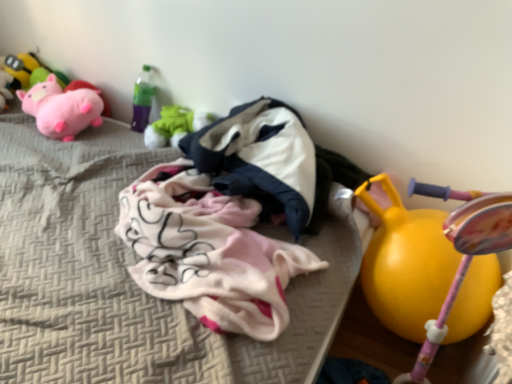
Question: Is rubber yellow ball at right, placed as the 1th toy when sorted from right to left, to the left of soft pink plush at upper left, positioned as the second toy in left-to-right order, from the viewer's perspective?

Choices:
 (A) no
 (B) yes

Answer: (A)

Question: Considering the relative positions of rubber yellow ball at right, placed as the 1th toy when sorted from right to left, and soft pink plush at upper left, positioned as the second toy in left-to-right order, in the image provided, is rubber yellow ball at right, placed as the 1th toy when sorted from right to left, behind soft pink plush at upper left, positioned as the second toy in left-to-right order,?

Choices:
 (A) yes
 (B) no

Answer: (B)

Question: Considering the relative positions of rubber yellow ball at right, which is counted as the fifth toy, starting from the left, and soft pink plush at upper left, acting as the fourth toy starting from the right, in the image provided, is rubber yellow ball at right, which is counted as the fifth toy, starting from the left, in front of soft pink plush at upper left, acting as the fourth toy starting from the right,?

Choices:
 (A) yes
 (B) no

Answer: (A)

Question: Can we say rubber yellow ball at right, which is counted as the fifth toy, starting from the left, lies outside soft pink plush at upper left, positioned as the second toy in left-to-right order?

Choices:
 (A) yes
 (B) no

Answer: (A)

Question: From the image's perspective, is rubber yellow ball at right, placed as the 1th toy when sorted from right to left, on top of soft pink plush at upper left, acting as the fourth toy starting from the right?

Choices:
 (A) no
 (B) yes

Answer: (A)

Question: From a real-world perspective, is rubber yellow ball at right, which is counted as the fifth toy, starting from the left, over soft pink plush at upper left, positioned as the second toy in left-to-right order?

Choices:
 (A) yes
 (B) no

Answer: (B)

Question: Is soft pink plush at upper left, positioned as the second toy in left-to-right order, at the right side of white fabric at center?

Choices:
 (A) yes
 (B) no

Answer: (B)

Question: Does soft pink plush at upper left, acting as the fourth toy starting from the right, have a greater width compared to white fabric at center?

Choices:
 (A) yes
 (B) no

Answer: (B)

Question: From a real-world perspective, is soft pink plush at upper left, acting as the fourth toy starting from the right, positioned under white fabric at center based on gravity?

Choices:
 (A) yes
 (B) no

Answer: (B)

Question: From the image's perspective, does soft pink plush at upper left, positioned as the second toy in left-to-right order, appear higher than white fabric at center?

Choices:
 (A) no
 (B) yes

Answer: (B)

Question: Can you confirm if soft pink plush at upper left, positioned as the second toy in left-to-right order, is smaller than white fabric at center?

Choices:
 (A) no
 (B) yes

Answer: (B)

Question: Is soft pink plush at upper left, acting as the fourth toy starting from the right, thinner than white fabric at center?

Choices:
 (A) yes
 (B) no

Answer: (A)

Question: From the image's perspective, would you say matte yellow toy at upper left, which is counted as the 5th toy, starting from the right, is positioned over white fabric at center?

Choices:
 (A) yes
 (B) no

Answer: (A)